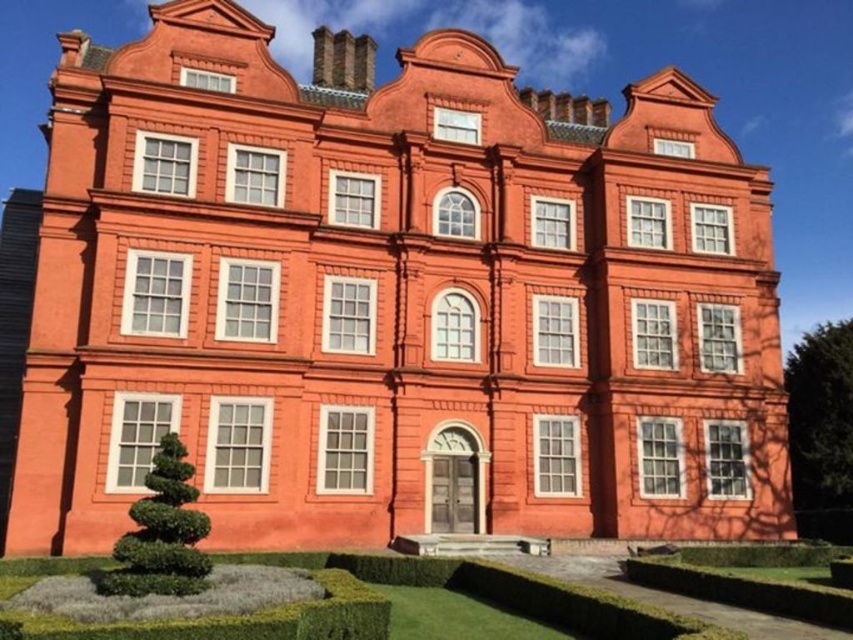
Question: Which point is farther from the camera taking this photo?

Choices:
 (A) (561, 611)
 (B) (154, 534)

Answer: (A)

Question: Does green hedge at lower center have a larger size compared to green leafy hedge at lower left?

Choices:
 (A) no
 (B) yes

Answer: (B)

Question: Which point is closer to the camera taking this photo?

Choices:
 (A) (195, 534)
 (B) (61, 564)

Answer: (A)

Question: Which of the following is the farthest from the observer?

Choices:
 (A) (503, 602)
 (B) (206, 586)

Answer: (A)

Question: Can you confirm if green hedge at lower center is positioned below green leafy hedge at lower left?

Choices:
 (A) no
 (B) yes

Answer: (B)

Question: Is green hedge at lower center closer to the viewer compared to green leafy hedge at lower left?

Choices:
 (A) yes
 (B) no

Answer: (A)